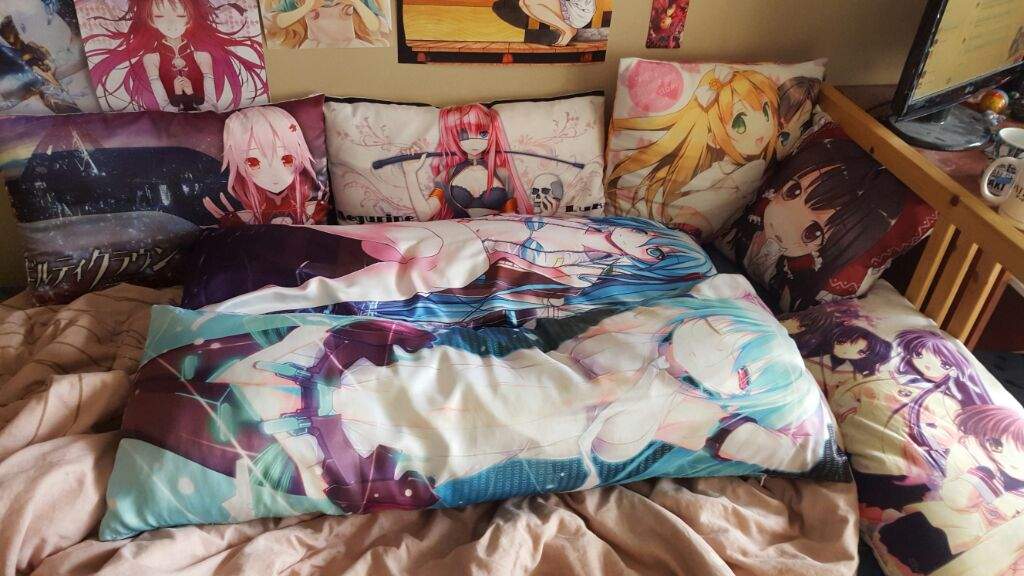
This screenshot has width=1024, height=576. What are the coordinates of `dark black pillow` in the screenshot? It's located at (116, 170).